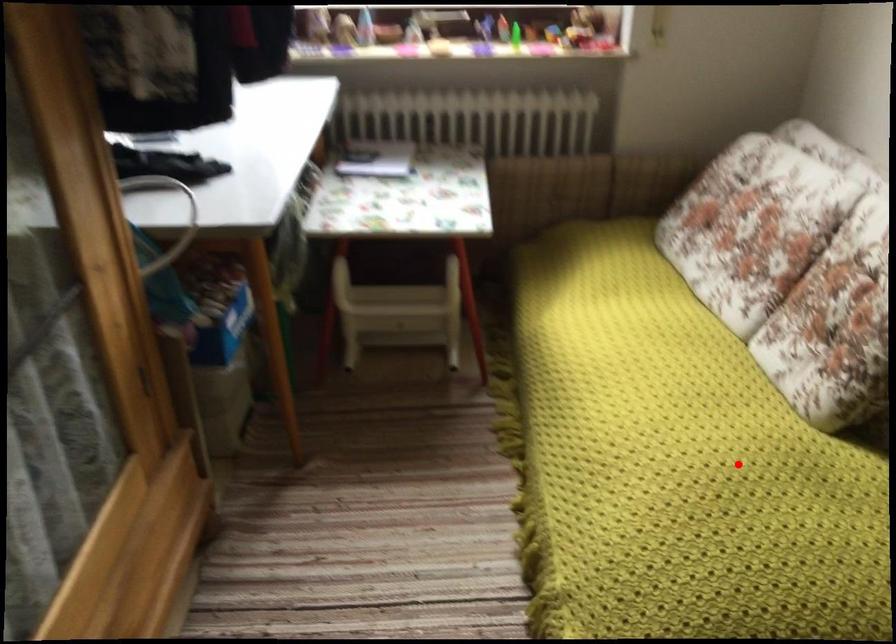
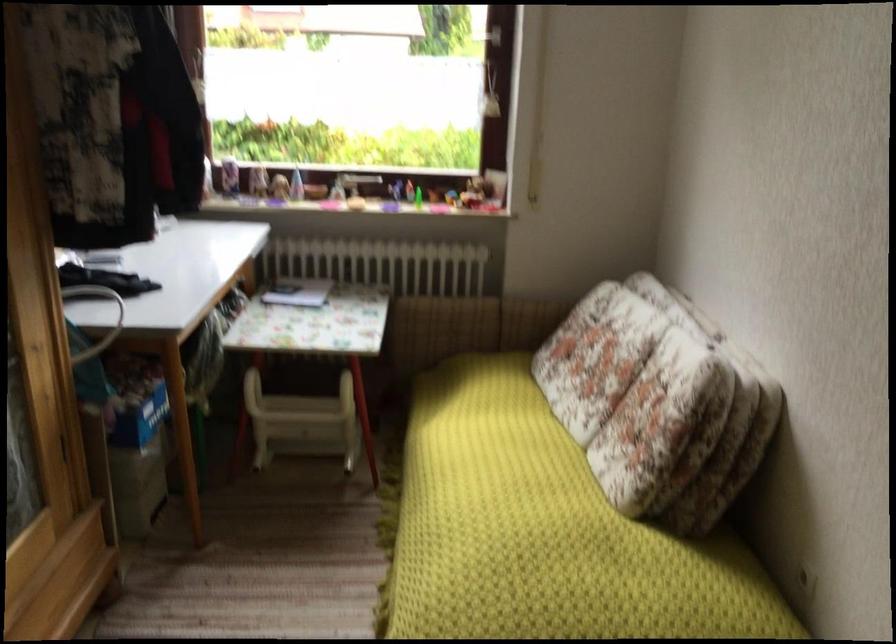
Question: I am providing you with two images of the same scene from different viewpoints. Given a red point in image1, look at the same physical point in image2. Is it:

Choices:
 (A) Closer to the viewpoint
 (B) Farther from the viewpoint

Answer: (B)